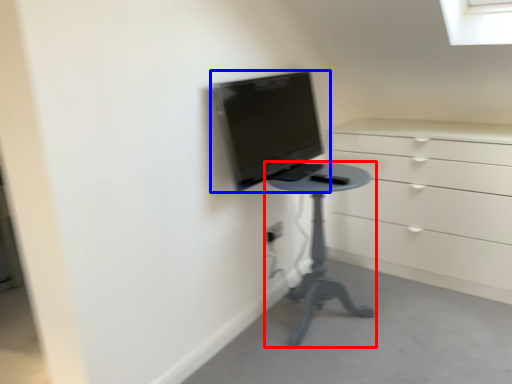
Question: Among these objects, which one is farthest to the camera, furniture (highlighted by a red box) or computer monitor (highlighted by a blue box)?

Choices:
 (A) furniture
 (B) computer monitor

Answer: (A)